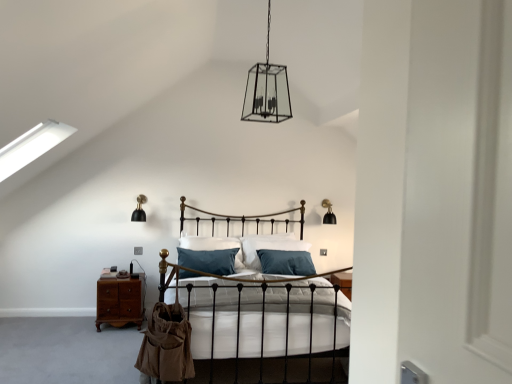
Question: From a real-world perspective, is teal fabric pillow at center physically below clear glass lantern at center, the 3th light fixture ordered from the bottom?

Choices:
 (A) no
 (B) yes

Answer: (B)

Question: Can you see teal fabric pillow at center touching clear glass lantern at center, which is the first light fixture from front to back?

Choices:
 (A) no
 (B) yes

Answer: (A)

Question: Is teal fabric pillow at center turned away from clear glass lantern at center, which is the 2th light fixture in left-to-right order?

Choices:
 (A) yes
 (B) no

Answer: (B)

Question: Is teal fabric pillow at center at the left side of clear glass lantern at center, acting as the second light fixture starting from the right?

Choices:
 (A) yes
 (B) no

Answer: (A)

Question: From the image's perspective, is teal fabric pillow at center below clear glass lantern at center, which is the 2th light fixture in left-to-right order?

Choices:
 (A) no
 (B) yes

Answer: (B)

Question: Is black matte wall sconce at left, arranged as the second light fixture when viewed from the back, wider or thinner than teal fabric pillow at center?

Choices:
 (A) thin
 (B) wide

Answer: (A)

Question: In the image, is black matte wall sconce at left, arranged as the second light fixture when viewed from the back, positioned in front of or behind teal fabric pillow at center?

Choices:
 (A) front
 (B) behind

Answer: (B)

Question: Is black matte wall sconce at left, acting as the second light fixture starting from the top, spatially inside teal fabric pillow at center, or outside of it?

Choices:
 (A) inside
 (B) outside

Answer: (B)

Question: In terms of height, does black matte wall sconce at left, acting as the second light fixture starting from the top, look taller or shorter compared to teal fabric pillow at center?

Choices:
 (A) short
 (B) tall

Answer: (A)

Question: Do you think clear glass lantern at center, the 3th light fixture ordered from the bottom, is within teal fabric pillow at center, or outside of it?

Choices:
 (A) outside
 (B) inside

Answer: (A)

Question: Considering the positions of point (258, 72) and point (215, 238), is point (258, 72) closer or farther from the camera than point (215, 238)?

Choices:
 (A) closer
 (B) farther

Answer: (A)

Question: Is clear glass lantern at center, acting as the second light fixture starting from the right, taller or shorter than teal fabric pillow at center?

Choices:
 (A) short
 (B) tall

Answer: (B)

Question: Is clear glass lantern at center, the 3th light fixture ordered from the bottom, in front of or behind teal fabric pillow at center in the image?

Choices:
 (A) behind
 (B) front

Answer: (B)

Question: From their relative heights in the image, would you say mahogany wood nightstand at lower left is taller or shorter than clear glass lantern at center, placed as the 1th light fixture when sorted from top to bottom?

Choices:
 (A) short
 (B) tall

Answer: (A)

Question: In terms of width, does mahogany wood nightstand at lower left look wider or thinner when compared to clear glass lantern at center, acting as the second light fixture starting from the right?

Choices:
 (A) wide
 (B) thin

Answer: (B)